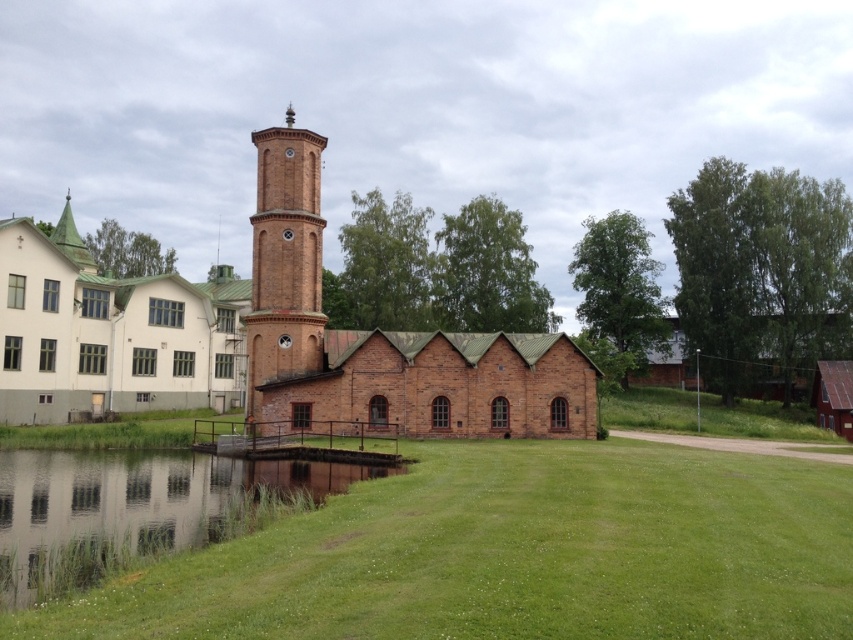
You are a landscape architect designing a walking path between the brick building at center and the green grass at lower left. The path must be exactly 12 meters long. Will the path reach both locations without needing adjustments?

The brick building at center is 12.35 meters from the green grass at lower left. Since the required path length is 12 meters, which is shorter than the actual distance between them, the path will not reach both locations without extending its length.

You are standing at the point closer to the camera in this scene. Which point are you at, point (502, 416) or point (33, 596)?

You are at point (502, 416) because it is further to the camera than point (33, 596).